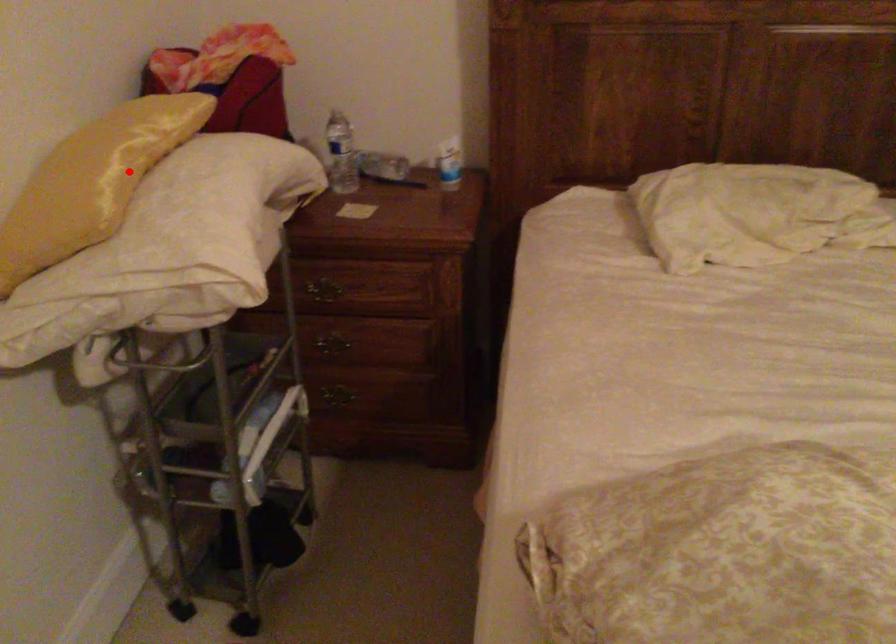
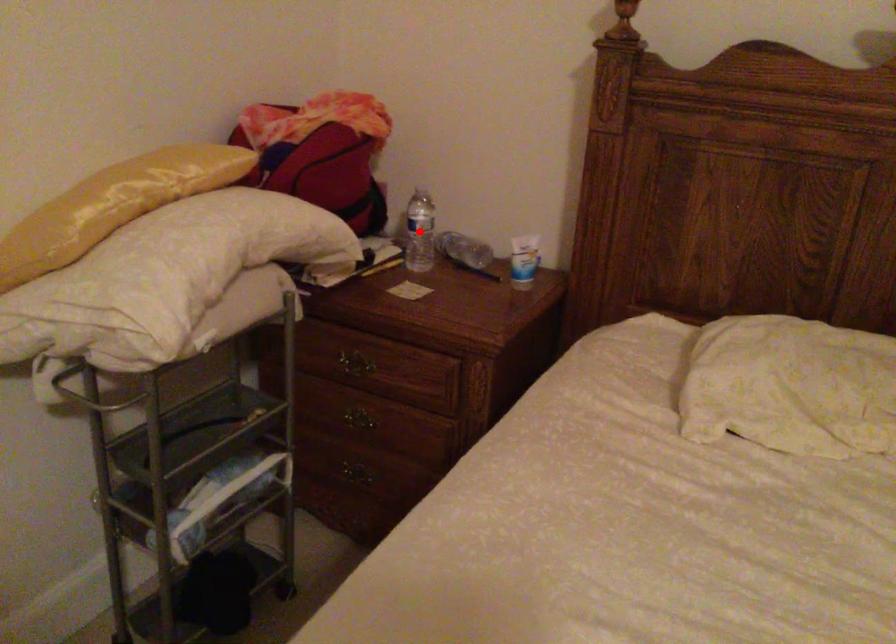
I am providing you with two images of the same scene from different viewpoints. A red point is marked on the first image and another point is marked on the second image. Are the points marked in image1 and image2 representing the same 3D position?

No